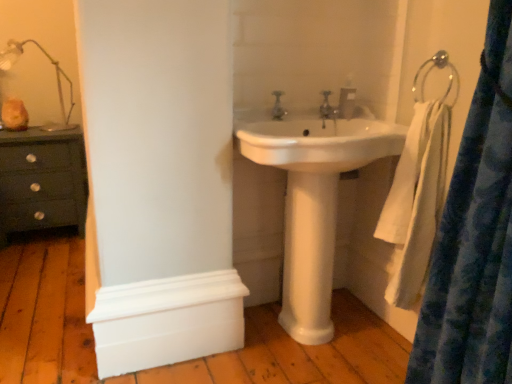
Question: Is matte silver faucet at center, the second tap positioned from the back, wider or thinner than silver metallic faucet at center, marked as the second tap in a front-to-back arrangement?

Choices:
 (A) wide
 (B) thin

Answer: (B)

Question: Considering the positions of matte silver faucet at center, the second tap positioned from the back, and silver metallic faucet at center, marked as the second tap in a front-to-back arrangement, in the image, is matte silver faucet at center, the second tap positioned from the back, taller or shorter than silver metallic faucet at center, marked as the second tap in a front-to-back arrangement,?

Choices:
 (A) short
 (B) tall

Answer: (A)

Question: Which object is the farthest from the dark wood chest of drawers at left?

Choices:
 (A) white glossy sink at center
 (B) silver metallic faucet at center, the second tap from the left
 (C) metallic silver towel ring at upper right
 (D) blue textured curtain at right
 (E) white painted wood molding at lower left

Answer: (D)

Question: Which object is positioned farthest from the dark wood chest of drawers at left?

Choices:
 (A) white painted wood molding at lower left
 (B) blue textured curtain at right
 (C) silver metallic faucet at center, acting as the first tap starting from the back
 (D) translucent glass lamp at upper left
 (E) metallic silver towel ring at upper right

Answer: (B)